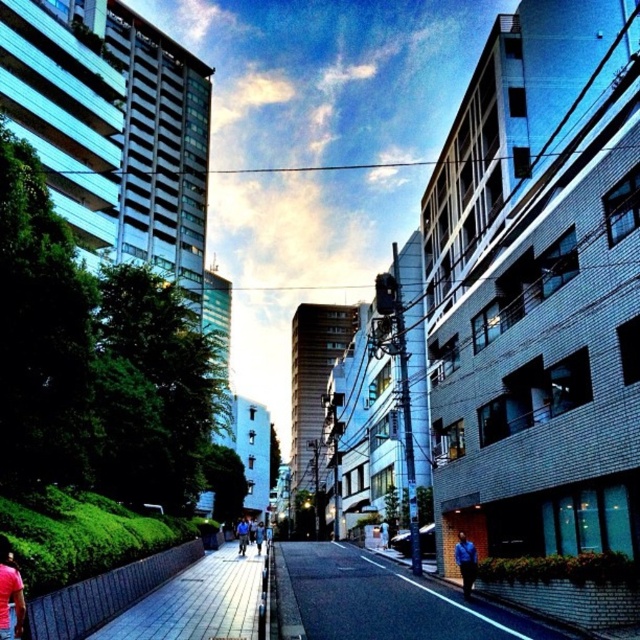
Question: Can you confirm if blue shirt at center is thinner than blue denim jacket at center?

Choices:
 (A) yes
 (B) no

Answer: (A)

Question: Is blue shirt at center to the right of blue denim jacket at center from the viewer's perspective?

Choices:
 (A) yes
 (B) no

Answer: (A)

Question: In this image, where is paved stone sidewalk at center located relative to blue denim jacket at center?

Choices:
 (A) left
 (B) right

Answer: (B)

Question: Among these objects, which one is farthest from the camera?

Choices:
 (A) paved stone sidewalk at center
 (B) dark asphalt road at center
 (C) blue denim jacket at center

Answer: (C)

Question: Which point appears closest to the camera in this image?

Choices:
 (A) (458, 552)
 (B) (3, 554)

Answer: (B)

Question: Among these objects, which one is farthest from the camera?

Choices:
 (A) blue denim jacket at center
 (B) blue shirt at center
 (C) dark asphalt road at center

Answer: (A)